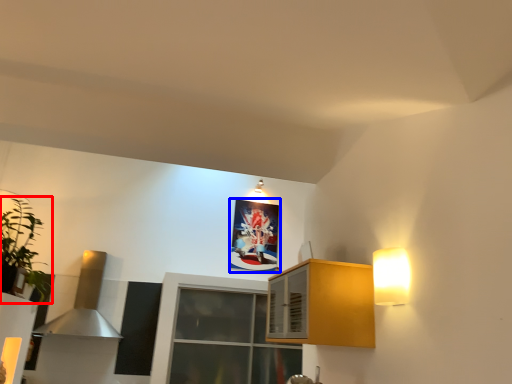
Question: Which object appears closest to the camera in this image, houseplant (highlighted by a red box) or picture frame (highlighted by a blue box)?

Choices:
 (A) houseplant
 (B) picture frame

Answer: (A)